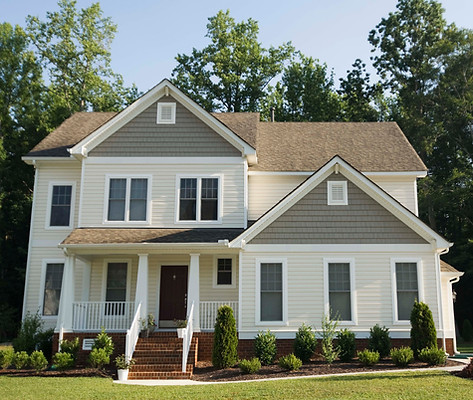
This screenshot has height=400, width=473. Find the location of `first floor windows`. first floor windows is located at coordinates (50, 293), (120, 287), (226, 273), (268, 288), (338, 294), (410, 286).